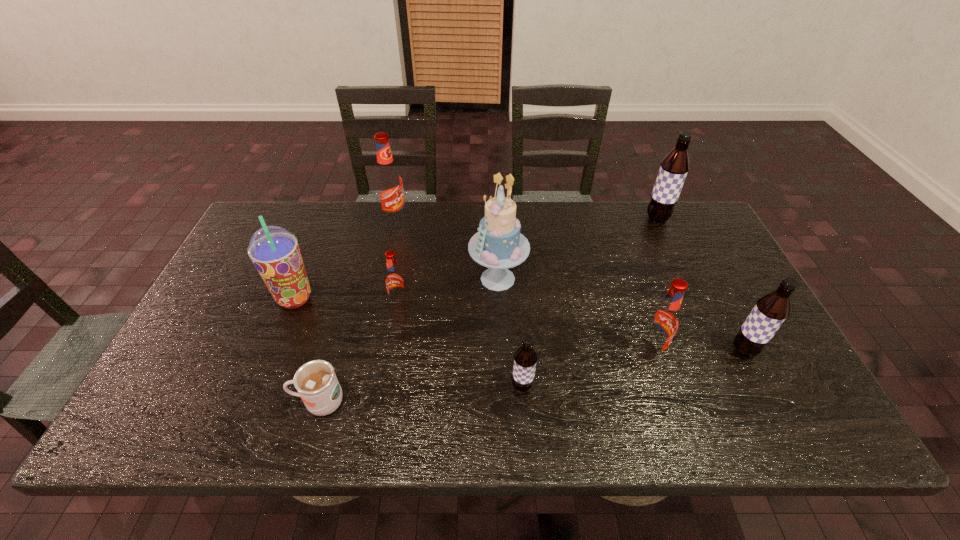
Find the location of `red root beer that is the closest to the smallest red root beer`. red root beer that is the closest to the smallest red root beer is located at coordinates (388, 180).

Locate an element on the screen. Image resolution: width=960 pixels, height=540 pixels. free region that satisfies the following two spatial constraints: 1. on the front side of the nearest root beer; 2. on the side with the handle of the cup is located at coordinates (523, 402).

The width and height of the screenshot is (960, 540). I want to click on blank area in the image that satisfies the following two spatial constraints: 1. with a ladder on the side of the second farthest brown root beer; 2. on the right side of the cake, so click(x=501, y=350).

Where is `blank space that satisfies the following two spatial constraints: 1. on the front side of the nearest brown root beer; 2. on the side with the handle of the cup`? blank space that satisfies the following two spatial constraints: 1. on the front side of the nearest brown root beer; 2. on the side with the handle of the cup is located at coordinates (523, 402).

You are a GUI agent. You are given a task and a screenshot of the screen. Output one action in this format:
    pyautogui.click(x=<x>, y=<y>)
    Task: Click on the vacant area in the image that satisfies the following two spatial constraints: 1. on the front side of the second farthest red root beer; 2. on the side with the handle of the shortest object
    
    Given the screenshot: What is the action you would take?
    pyautogui.click(x=382, y=402)

The width and height of the screenshot is (960, 540). Identify the location of vacant region that satisfies the following two spatial constraints: 1. on the front side of the nearest red root beer; 2. on the left side of the second nearest red root beer. (391, 352).

At what (x,y) coordinates should I click in order to perform the action: click on free space that satisfies the following two spatial constraints: 1. on the front side of the nearest red root beer; 2. on the right side of the smallest red root beer. Please return your answer as a coordinate pair (x, y). This screenshot has width=960, height=540. Looking at the image, I should click on (391, 352).